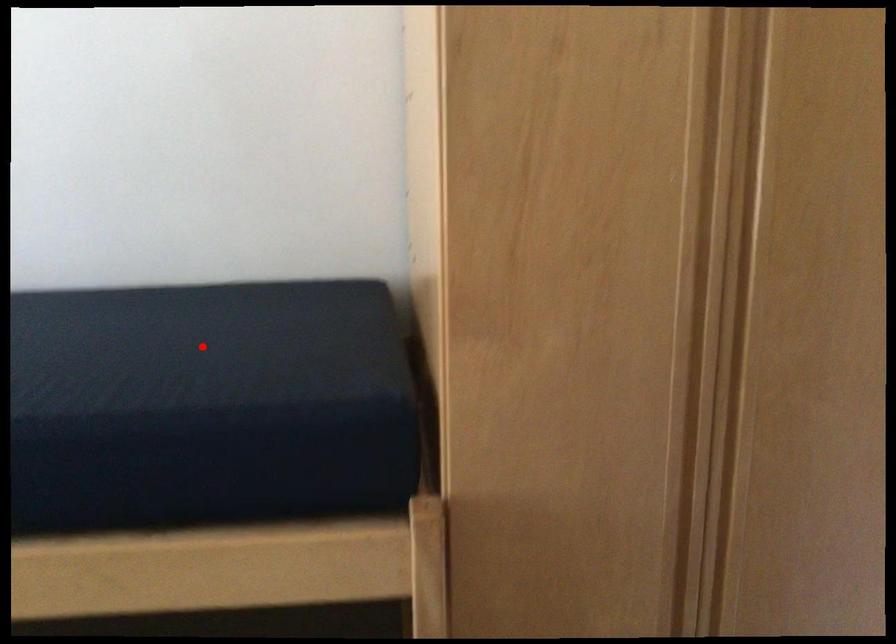
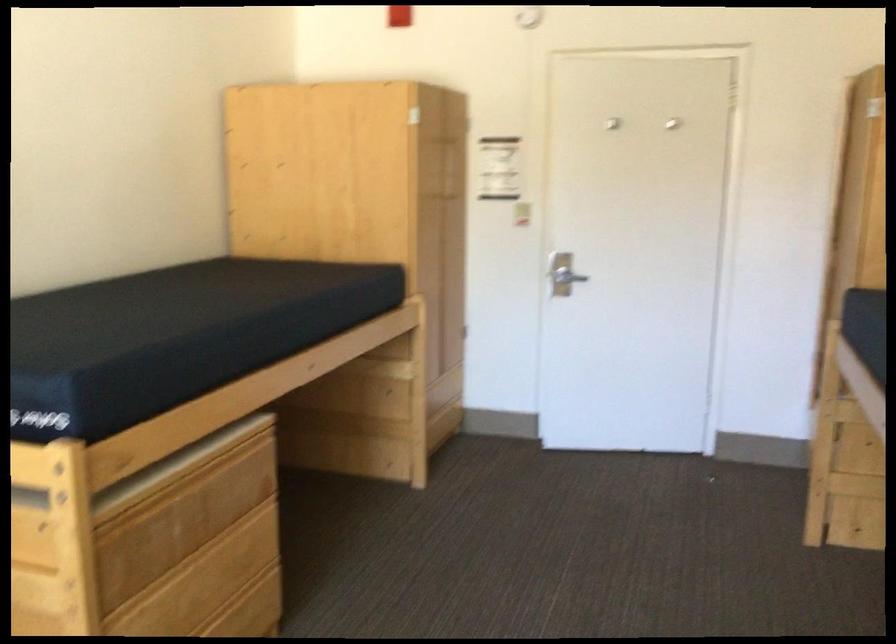
Question: I am providing you with two images of the same scene from different viewpoints. Given a red point in image1, look at the same physical point in image2. Is it:

Choices:
 (A) Closer to the viewpoint
 (B) Farther from the viewpoint

Answer: (B)